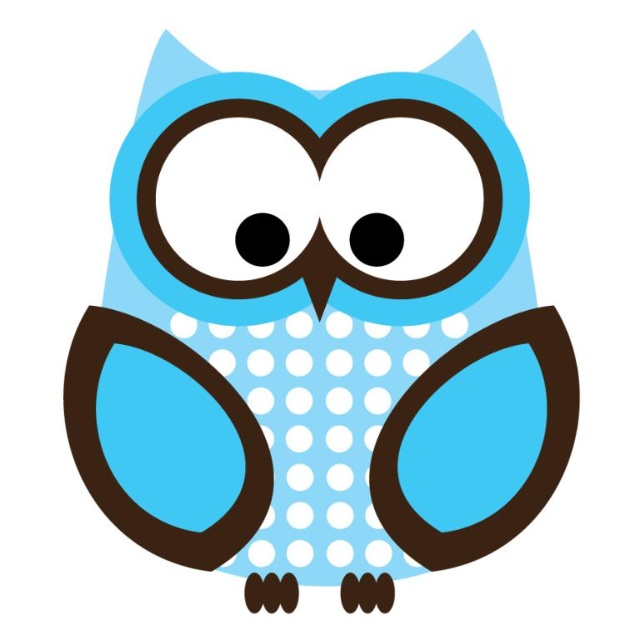
Who is higher up, matte blue polka dot owl at center or black matte circle at center?

Positioned higher is black matte circle at center.

Is point (202, 83) positioned after point (248, 262)?

No, it is not.

At what (x,y) coordinates should I click in order to perform the action: click on matte blue polka dot owl at center. Please return your answer as a coordinate pair (x, y). The width and height of the screenshot is (640, 640). Looking at the image, I should click on (317, 356).

The image size is (640, 640). I want to click on matte blue polka dot owl at center, so click(x=317, y=356).

Is point (272, 250) less distant than point (376, 227)?

Yes, point (272, 250) is closer to viewer.

Between point (280, 252) and point (360, 244), which one is positioned behind?

Positioned behind is point (360, 244).

This screenshot has width=640, height=640. Describe the element at coordinates (260, 240) in the screenshot. I see `black matte circle at center` at that location.

Where is `black matte circle at center`? black matte circle at center is located at coordinates (260, 240).

Does matte blue polka dot owl at center appear on the left side of black glossy eye at center?

Correct, you'll find matte blue polka dot owl at center to the left of black glossy eye at center.

Which is behind, point (307, 147) or point (356, 237)?

Point (307, 147)

This screenshot has width=640, height=640. I want to click on matte blue polka dot owl at center, so click(x=317, y=356).